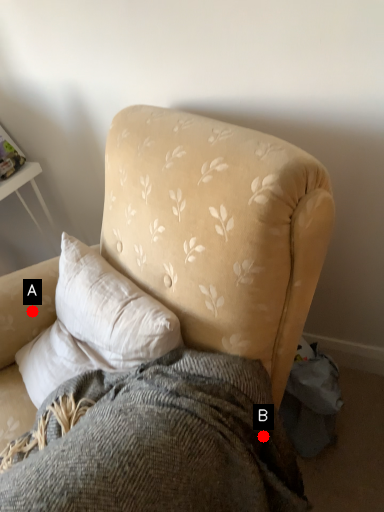
Question: Two points are circled on the image, labeled by A and B beside each circle. Which point appears closest to the camera in this image?

Choices:
 (A) A is closer
 (B) B is closer

Answer: (B)